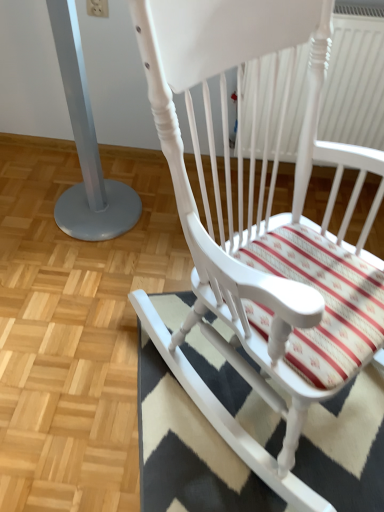
At what (x,y) coordinates should I click in order to perform the action: click on free location in front of silver metallic pole at left. Please return your answer as a coordinate pair (x, y). Looking at the image, I should click on (87, 270).